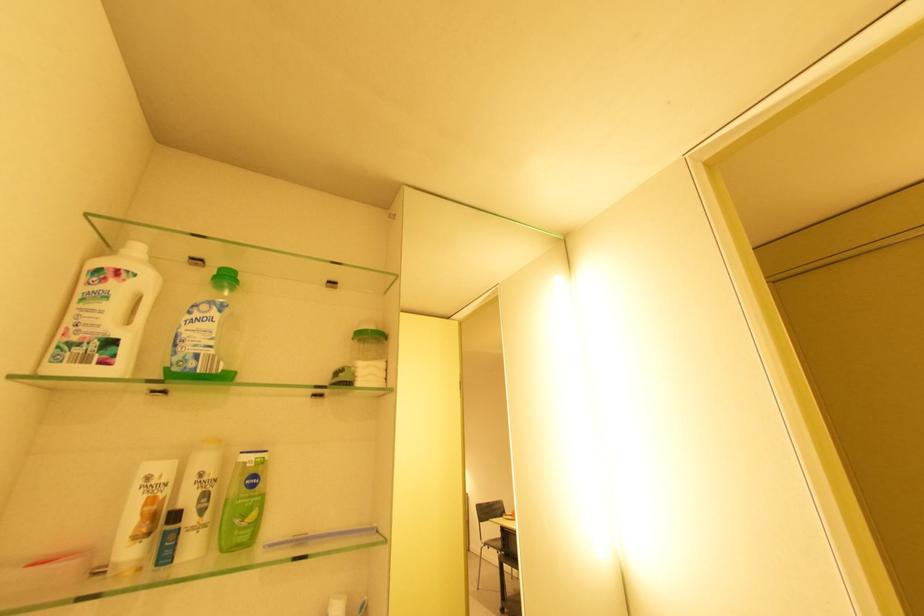
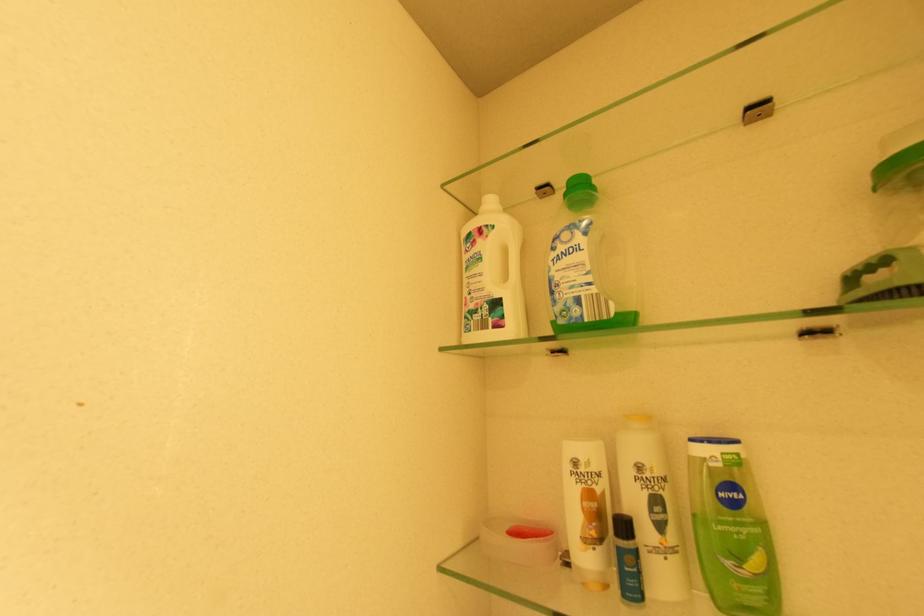
Question: The camera is either moving clockwise (left) or counter-clockwise (right) around the object. The first image is from the beginning of the video and the second image is from the end. Is the camera moving left or right when shooting the video?

Choices:
 (A) Left
 (B) Right

Answer: (B)